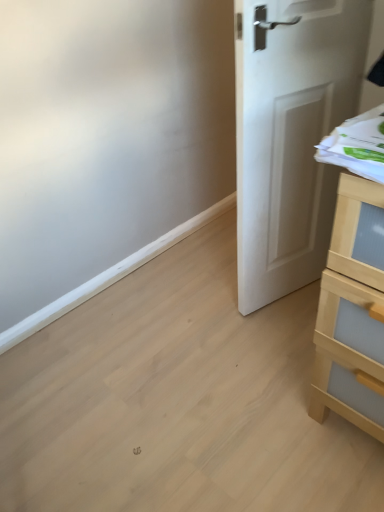
Question: Considering their positions, is white matte door at center located in front of or behind light wood chest of drawers at right?

Choices:
 (A) behind
 (B) front

Answer: (A)

Question: Considering the positions of white matte door at center and light wood chest of drawers at right in the image, is white matte door at center taller or shorter than light wood chest of drawers at right?

Choices:
 (A) short
 (B) tall

Answer: (B)

Question: From the image's perspective, relative to light wood chest of drawers at right, is white matte door at center above or below?

Choices:
 (A) below
 (B) above

Answer: (B)

Question: In terms of width, does light wood chest of drawers at right look wider or thinner when compared to white matte door at center?

Choices:
 (A) thin
 (B) wide

Answer: (B)

Question: In terms of size, does light wood chest of drawers at right appear bigger or smaller than white matte door at center?

Choices:
 (A) big
 (B) small

Answer: (A)

Question: Is light wood chest of drawers at right inside the boundaries of white matte door at center, or outside?

Choices:
 (A) outside
 (B) inside

Answer: (A)

Question: Is light wood chest of drawers at right in front of or behind white matte door at center in the image?

Choices:
 (A) behind
 (B) front

Answer: (B)